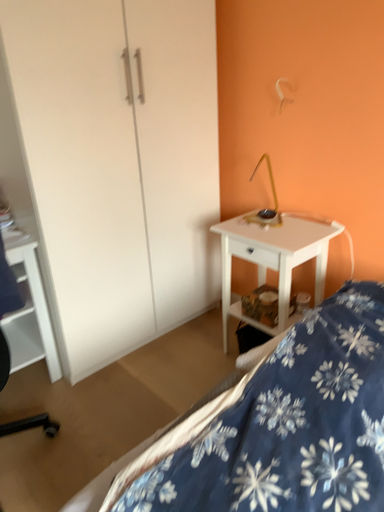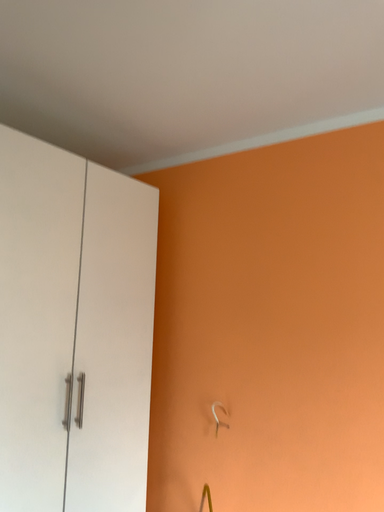
Question: How did the camera likely rotate when shooting the video?

Choices:
 (A) rotated upward
 (B) rotated downward

Answer: (A)